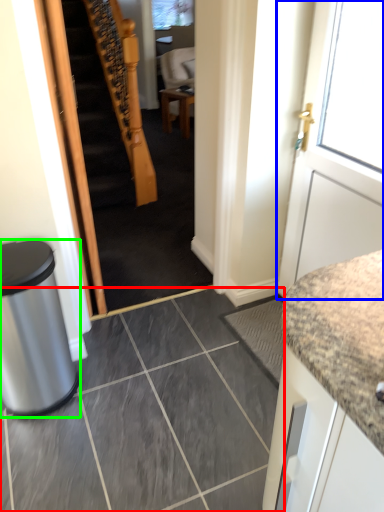
Question: Which object is the closest to the ceramic tile (highlighted by a red box)? Choose among these: door (highlighted by a blue box) or trash bin/can (highlighted by a green box).

Choices:
 (A) door
 (B) trash bin/can

Answer: (B)